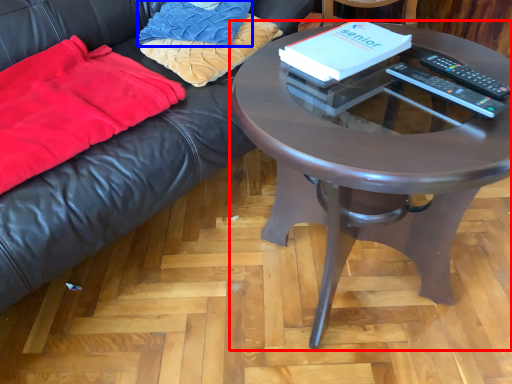
Question: Which object appears closest to the camera in this image, coffee table (highlighted by a red box) or pillow (highlighted by a blue box)?

Choices:
 (A) coffee table
 (B) pillow

Answer: (A)